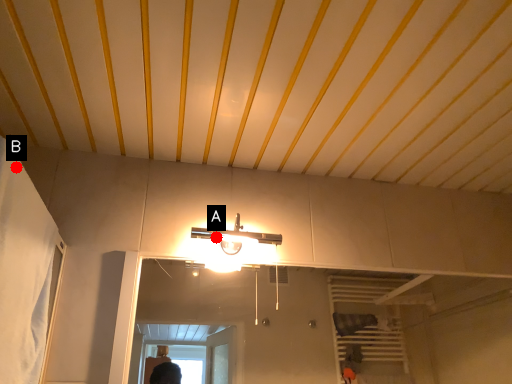
Question: Two points are circled on the image, labeled by A and B beside each circle. Which point appears closest to the camera in this image?

Choices:
 (A) A is closer
 (B) B is closer

Answer: (B)